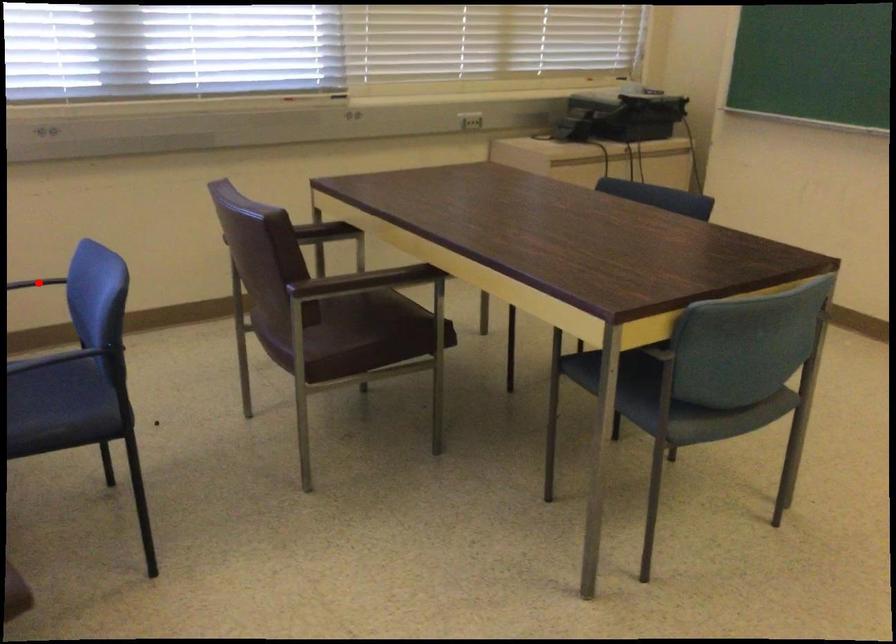
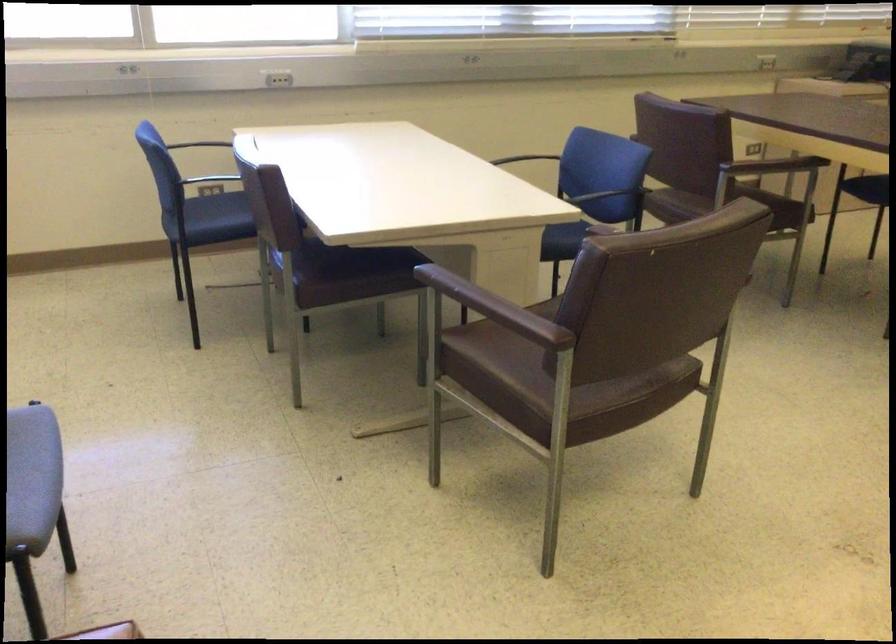
Question: I am providing you with two images of the same scene from different viewpoints. A red point is marked on the first image. Can you still see the location of the red point in image 2?

Choices:
 (A) Yes
 (B) No

Answer: (B)